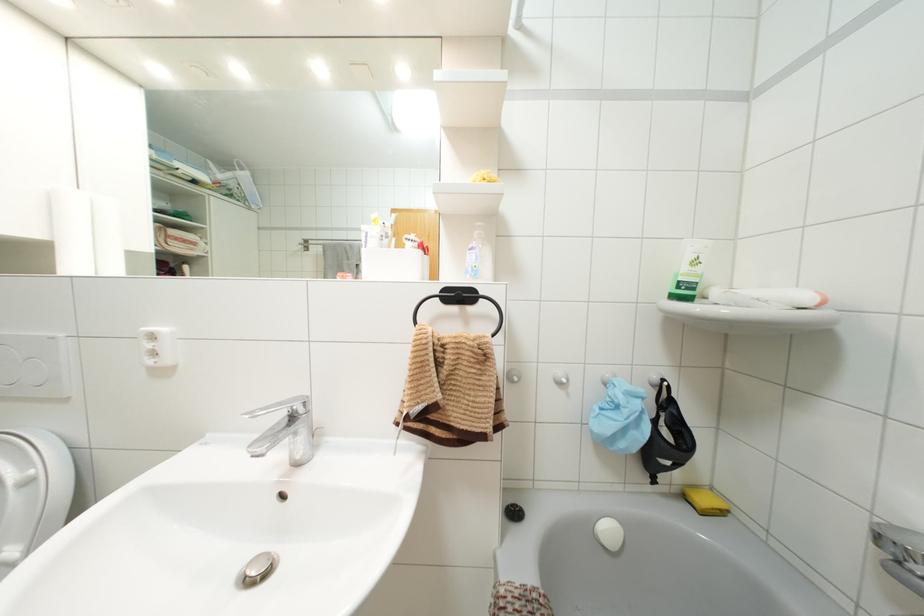
This screenshot has height=616, width=924. Describe the element at coordinates (688, 270) in the screenshot. I see `the green shampoo bottle` at that location.